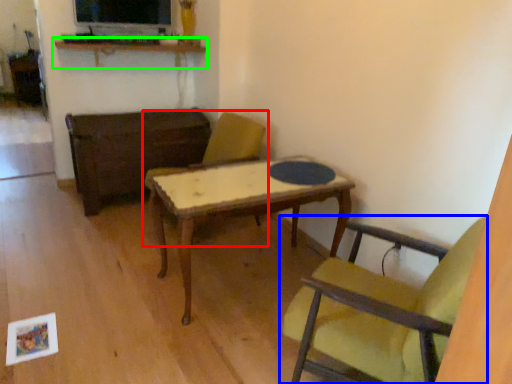
Question: Considering the real-world distances, which object is farthest from chair (highlighted by a red box)? chair (highlighted by a blue box) or shelf (highlighted by a green box)?

Choices:
 (A) chair
 (B) shelf

Answer: (A)